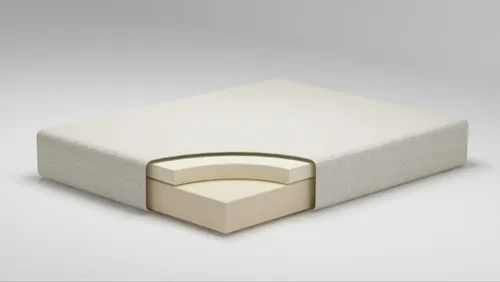
Locate an element on the screen. Image resolution: width=500 pixels, height=282 pixels. soap is located at coordinates (226, 181).